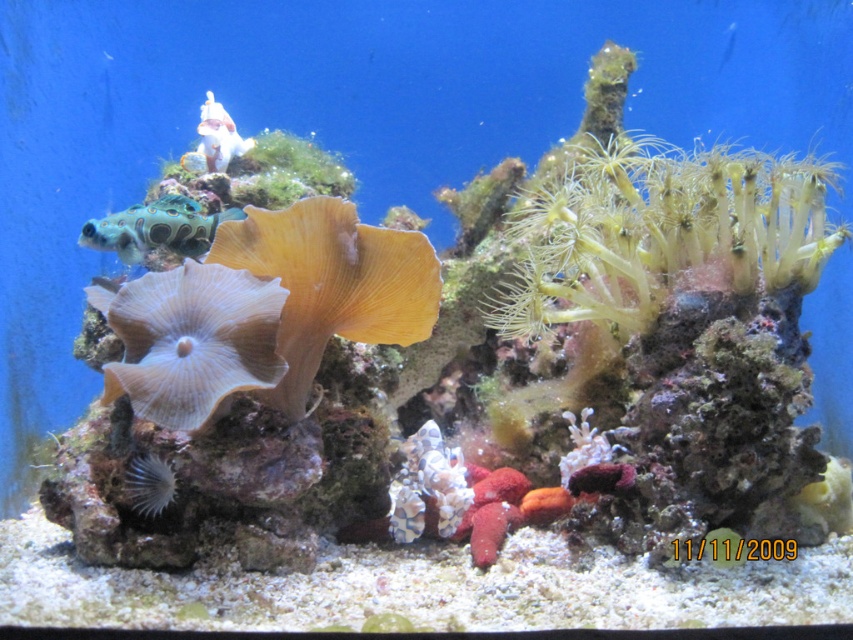
Based on the photo, you are an underwater photographer with a camera that has a maximum focus range of 25 inches. You want to take a photo of both the white translucent coral at center and the white glossy statue at upper center in the same frame. Can you position yourself so that both are within the focus range of your camera?

The distance between the white translucent coral at center and the white glossy statue at upper center is 25.27 inches. Since your camera has a maximum focus range of 25 inches, the two objects are slightly out of range. You might need to adjust your position to reduce the distance between them in the frame or use a different camera with a longer focus range.

You are an underwater photographer aiming to capture both the white translucent coral at center and the white glossy statue at upper center in a single frame. Based on their positions, which object should you focus on first to ensure both are in the shot?

The white translucent coral at center is below the white glossy statue at upper center, so you should focus on the white glossy statue at upper center first to ensure both are in the frame.